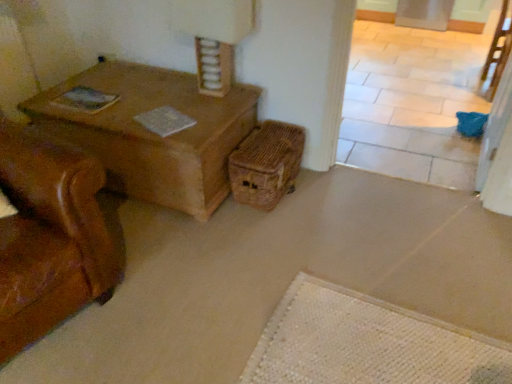
I want to click on free space behind brown woven chair at upper right, so click(463, 82).